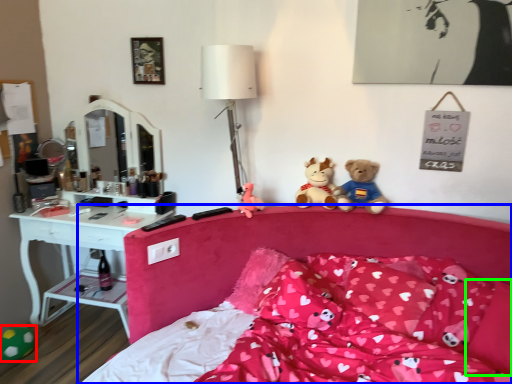
Question: Which object is the closest to the toy (highlighted by a red box)? Choose among these: bed (highlighted by a blue box) or pillow (highlighted by a green box).

Choices:
 (A) bed
 (B) pillow

Answer: (A)